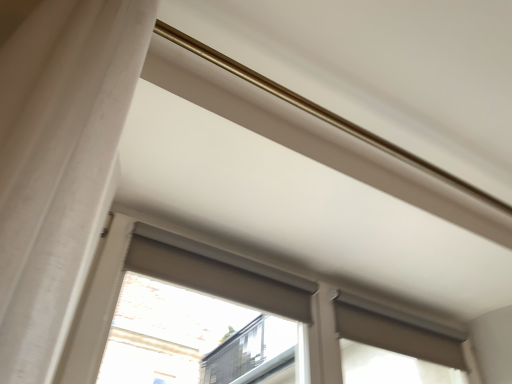
I want to click on matte gray roller shade at upper center, so click(x=201, y=316).

Locate an element on the screen. matte gray roller blind at upper right, which is counted as the 2th window, starting from the top is located at coordinates 394,350.

Identify the location of matte gray roller blind at center, acting as the 1th window starting from the top. The width and height of the screenshot is (512, 384). (169, 281).

At what (x,y) coordinates should I click in order to perform the action: click on matte gray roller shade at upper center. Please return your answer as a coordinate pair (x, y). This screenshot has height=384, width=512. Looking at the image, I should click on (201, 316).

Considering the points (409, 367) and (190, 264), which point is behind, point (409, 367) or point (190, 264)?

The point (409, 367) is more distant.

Is there a large distance between matte gray roller blind at upper right, which is counted as the 2th window, starting from the top, and matte gray roller blind at center, acting as the 1th window starting from the top?

matte gray roller blind at upper right, which is counted as the 2th window, starting from the top, is actually quite close to matte gray roller blind at center, acting as the 1th window starting from the top.

Is matte gray roller blind at center, acting as the 1th window starting from the top, completely or partially inside matte gray roller blind at upper right, which is counted as the 2th window, starting from the top?

Definitely not — matte gray roller blind at center, acting as the 1th window starting from the top, is not inside matte gray roller blind at upper right, which is counted as the 2th window, starting from the top.

From the image's perspective, which is below, matte gray roller blind at upper right, which is counted as the 2th window, starting from the top, or matte gray roller blind at center, acting as the 1th window starting from the top?

matte gray roller blind at upper right, which is counted as the 2th window, starting from the top, is shown below in the image.

From the picture: Is matte gray roller blind at upper right, which is counted as the 2th window, starting from the top, bigger than matte gray roller shade at upper center?

Yes.

Is matte gray roller blind at upper right, which appears as the first window when ordered from the bottom, in contact with matte gray roller shade at upper center?

They are not placed beside each other.

What's the angular difference between matte gray roller blind at upper right, which appears as the first window when ordered from the bottom, and matte gray roller shade at upper center's facing directions?

There is a 0.0033-degree angle between the facing directions of matte gray roller blind at upper right, which appears as the first window when ordered from the bottom, and matte gray roller shade at upper center.

Find the location of a particular element. window that is above the matte gray roller blind at center, which is the second window in bottom-to-top order (from a real-world perspective) is located at coordinates (394, 350).

From the image's perspective, is matte gray roller blind at center, which is the second window in bottom-to-top order, on top of matte gray roller blind at upper right, which appears as the first window when ordered from the bottom?

Yes, from the image's perspective, matte gray roller blind at center, which is the second window in bottom-to-top order, is on top of matte gray roller blind at upper right, which appears as the first window when ordered from the bottom.

Is matte gray roller blind at center, acting as the 1th window starting from the top, not close to matte gray roller blind at upper right, which is counted as the 2th window, starting from the top?

No, there isn't a large distance between matte gray roller blind at center, acting as the 1th window starting from the top, and matte gray roller blind at upper right, which is counted as the 2th window, starting from the top.

Between matte gray roller blind at center, acting as the 1th window starting from the top, and matte gray roller shade at upper center, which one has larger width?

With larger width is matte gray roller shade at upper center.

Between matte gray roller blind at center, which is the second window in bottom-to-top order, and matte gray roller shade at upper center, which one appears on the right side from the viewer's perspective?

Positioned to the right is matte gray roller blind at center, which is the second window in bottom-to-top order.

Is matte gray roller blind at center, which is the second window in bottom-to-top order, positioned with its back to matte gray roller shade at upper center?

Yes, matte gray roller blind at center, which is the second window in bottom-to-top order, is facing away from matte gray roller shade at upper center.

How distant is matte gray roller blind at center, acting as the 1th window starting from the top, from matte gray roller shade at upper center?

The distance of matte gray roller blind at center, acting as the 1th window starting from the top, from matte gray roller shade at upper center is 3.35 feet.

Does matte gray roller shade at upper center have a greater height compared to matte gray roller blind at upper right, which appears as the first window when ordered from the bottom?

No, matte gray roller shade at upper center is not taller than matte gray roller blind at upper right, which appears as the first window when ordered from the bottom.

Who is bigger, matte gray roller shade at upper center or matte gray roller blind at upper right, which appears as the first window when ordered from the bottom?

matte gray roller blind at upper right, which appears as the first window when ordered from the bottom, is bigger.

From the image's perspective, is matte gray roller shade at upper center located above matte gray roller blind at upper right, which is counted as the 2th window, starting from the top?

Yes, from the image's perspective, matte gray roller shade at upper center is on top of matte gray roller blind at upper right, which is counted as the 2th window, starting from the top.

Is matte gray roller shade at upper center oriented towards matte gray roller blind at center, acting as the 1th window starting from the top?

No, matte gray roller shade at upper center is not oriented towards matte gray roller blind at center, acting as the 1th window starting from the top.

Considering the points (208, 290) and (125, 256), which point is in front, point (208, 290) or point (125, 256)?

Point (125, 256)

Is there a large distance between matte gray roller shade at upper center and matte gray roller blind at center, acting as the 1th window starting from the top?

matte gray roller shade at upper center is positioned a significant distance from matte gray roller blind at center, acting as the 1th window starting from the top.

Consider the image. Is matte gray roller shade at upper center behind matte gray roller blind at center, acting as the 1th window starting from the top?

Yes, matte gray roller shade at upper center is further from the camera.

Find the location of a particular element. This screenshot has width=512, height=384. window on the right side of matte gray roller blind at center, which is the second window in bottom-to-top order is located at coordinates (394, 350).

Where is `bay window located underneath the matte gray roller blind at upper right, which appears as the first window when ordered from the bottom (from a real-world perspective)`? This screenshot has height=384, width=512. bay window located underneath the matte gray roller blind at upper right, which appears as the first window when ordered from the bottom (from a real-world perspective) is located at coordinates (201, 316).

Considering their positions, is matte gray roller blind at center, which is the second window in bottom-to-top order, positioned closer to matte gray roller shade at upper center than matte gray roller blind at upper right, which is counted as the 2th window, starting from the top?

Based on the image, matte gray roller blind at upper right, which is counted as the 2th window, starting from the top, appears to be nearer to matte gray roller shade at upper center.

Estimate the real-world distances between objects in this image. Which object is further from matte gray roller blind at upper right, which appears as the first window when ordered from the bottom, matte gray roller blind at center, which is the second window in bottom-to-top order, or matte gray roller shade at upper center?

The object further to matte gray roller blind at upper right, which appears as the first window when ordered from the bottom, is matte gray roller shade at upper center.

When comparing their distances from matte gray roller blind at center, which is the second window in bottom-to-top order, does matte gray roller shade at upper center or matte gray roller blind at upper right, which is counted as the 2th window, starting from the top, seem closer?

matte gray roller blind at upper right, which is counted as the 2th window, starting from the top, is positioned closer to the anchor matte gray roller blind at center, which is the second window in bottom-to-top order.

Which object lies nearer to the anchor point matte gray roller shade at upper center, matte gray roller blind at upper right, which is counted as the 2th window, starting from the top, or matte gray roller blind at center, acting as the 1th window starting from the top?

The object closer to matte gray roller shade at upper center is matte gray roller blind at upper right, which is counted as the 2th window, starting from the top.

When comparing their distances from matte gray roller blind at center, which is the second window in bottom-to-top order, does matte gray roller blind at upper right, which is counted as the 2th window, starting from the top, or matte gray roller shade at upper center seem closer?

matte gray roller blind at upper right, which is counted as the 2th window, starting from the top, lies closer to matte gray roller blind at center, which is the second window in bottom-to-top order, than the other object.

Estimate the real-world distances between objects in this image. Which object is further from matte gray roller blind at upper right, which is counted as the 2th window, starting from the top, matte gray roller shade at upper center or matte gray roller blind at center, acting as the 1th window starting from the top?

Based on the image, matte gray roller shade at upper center appears to be further to matte gray roller blind at upper right, which is counted as the 2th window, starting from the top.

At what (x,y) coordinates should I click in order to perform the action: click on window between matte gray roller shade at upper center and matte gray roller blind at upper right, which is counted as the 2th window, starting from the top, in the horizontal direction. Please return your answer as a coordinate pair (x, y). Looking at the image, I should click on (169, 281).